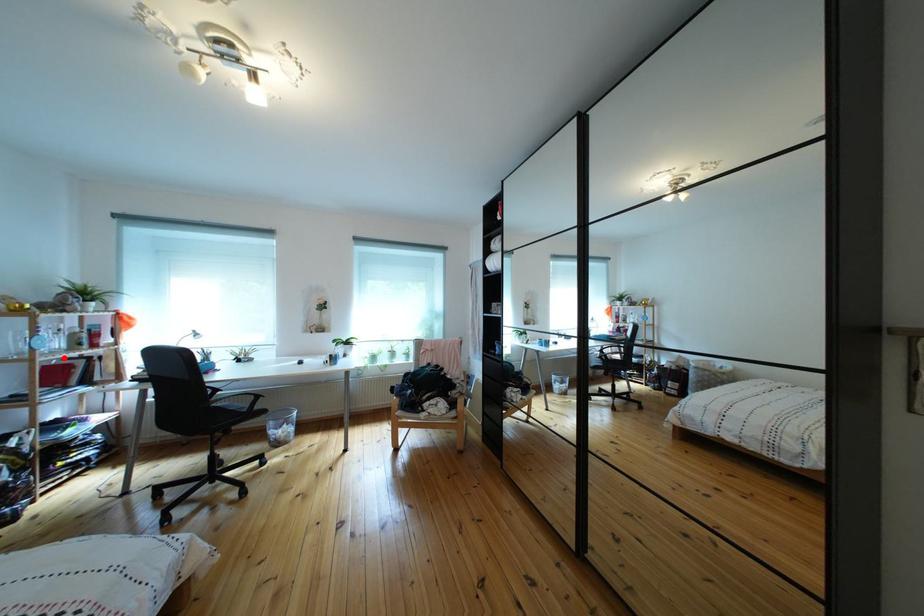
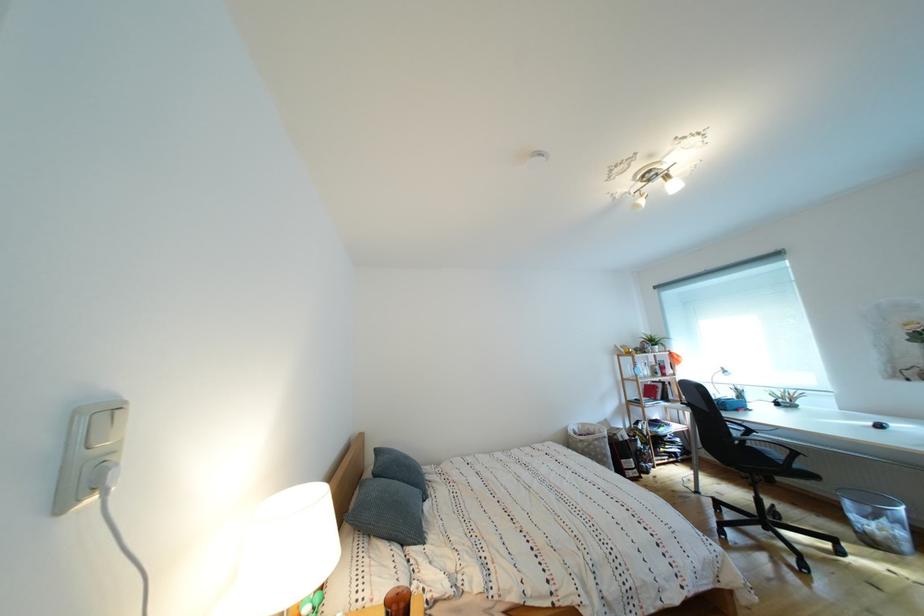
In the second image, find the point that corresponds to the highlighted location in the first image.

(657, 383)